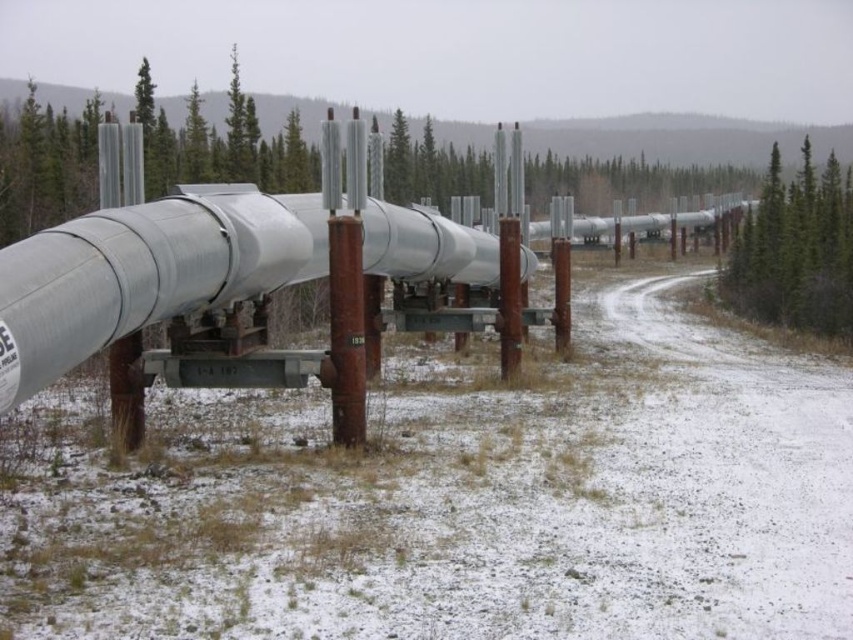
You are an environmental inspector assessing the pipeline area. You notice two trees in the image, the green leafy tree at upper right and the green textured pine tree at upper center. Which tree is closer to the pipeline system?

The green leafy tree at upper right is closer to the pipeline system because it is in front of the green textured pine tree at upper center, indicating it is positioned nearer to the observer and thus the pipeline.

You are a hiker trying to determine which tree is taller between the green leafy tree at upper right and the green textured pine tree at upper center. Based on the scene description, which one is taller?

The green textured pine tree at upper center is taller than the green leafy tree at upper right.

You are a hiker lost in the snowy forest and see the green leafy tree at upper right and the green textured pine tree at upper center in the distance. Which tree would you see first as you approach the forest from the clearing ahead?

The green textured pine tree at upper center would be seen first because it is positioned above the green leafy tree at upper right, making it visible from a greater distance.